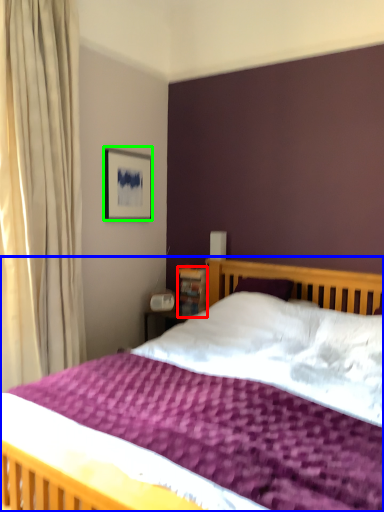
Question: Which object is the farthest from bookshelf (highlighted by a red box)? Choose among these: bed (highlighted by a blue box) or picture frame (highlighted by a green box).

Choices:
 (A) bed
 (B) picture frame

Answer: (A)